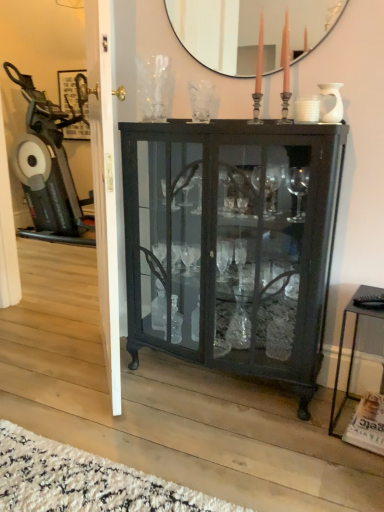
Question: Can you confirm if matte black mirror at upper center is bigger than matte black cabinet at center?

Choices:
 (A) no
 (B) yes

Answer: (A)

Question: Can we say matte black mirror at upper center lies outside matte black cabinet at center?

Choices:
 (A) no
 (B) yes

Answer: (B)

Question: Could you tell me if matte black mirror at upper center is turned towards matte black cabinet at center?

Choices:
 (A) yes
 (B) no

Answer: (B)

Question: From the image's perspective, does matte black mirror at upper center appear lower than matte black cabinet at center?

Choices:
 (A) yes
 (B) no

Answer: (B)

Question: Does matte black mirror at upper center lie behind matte black cabinet at center?

Choices:
 (A) yes
 (B) no

Answer: (A)

Question: Does matte black mirror at upper center lie in front of matte black cabinet at center?

Choices:
 (A) yes
 (B) no

Answer: (B)

Question: From a real-world perspective, is matte black cabinet at center under black metal side table at lower right?

Choices:
 (A) yes
 (B) no

Answer: (B)

Question: Is matte black cabinet at center facing away from black metal side table at lower right?

Choices:
 (A) no
 (B) yes

Answer: (A)

Question: Does matte black cabinet at center turn towards black metal side table at lower right?

Choices:
 (A) no
 (B) yes

Answer: (A)

Question: Considering the relative sizes of matte black cabinet at center and black metal side table at lower right in the image provided, is matte black cabinet at center smaller than black metal side table at lower right?

Choices:
 (A) yes
 (B) no

Answer: (B)

Question: Does matte black cabinet at center touch black metal side table at lower right?

Choices:
 (A) yes
 (B) no

Answer: (B)

Question: From the image's perspective, would you say matte black cabinet at center is shown under black metal side table at lower right?

Choices:
 (A) no
 (B) yes

Answer: (A)

Question: Is black metal side table at lower right taller than white glossy door at center?

Choices:
 (A) no
 (B) yes

Answer: (A)